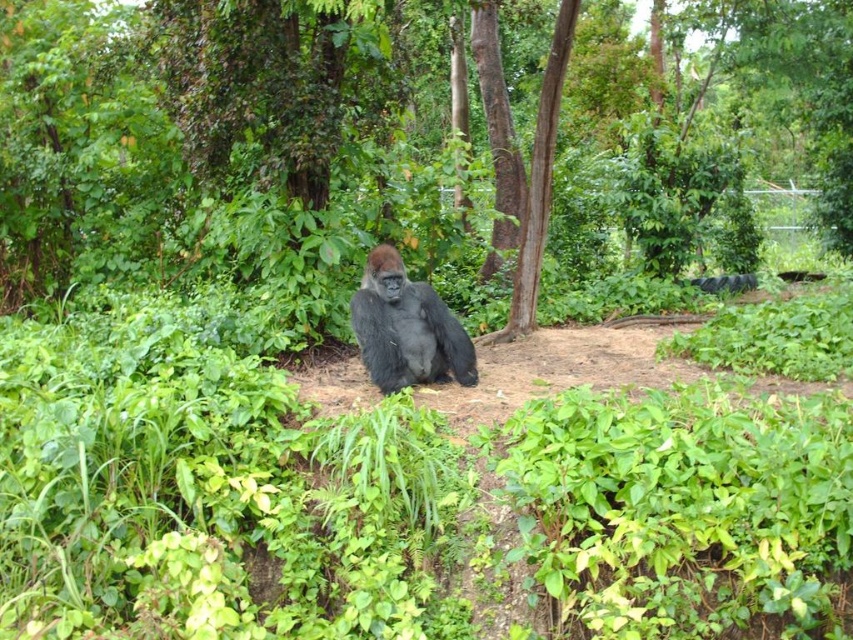
What do you see at coordinates (405, 328) in the screenshot?
I see `dark gray fur gorilla at center` at bounding box center [405, 328].

Who is shorter, dark gray fur gorilla at center or brown rough tree at center?

dark gray fur gorilla at center is shorter.

Does point (399, 296) come closer to viewer compared to point (535, 266)?

Yes, it is in front of point (535, 266).

Where is `dark gray fur gorilla at center`? The width and height of the screenshot is (853, 640). dark gray fur gorilla at center is located at coordinates (405, 328).